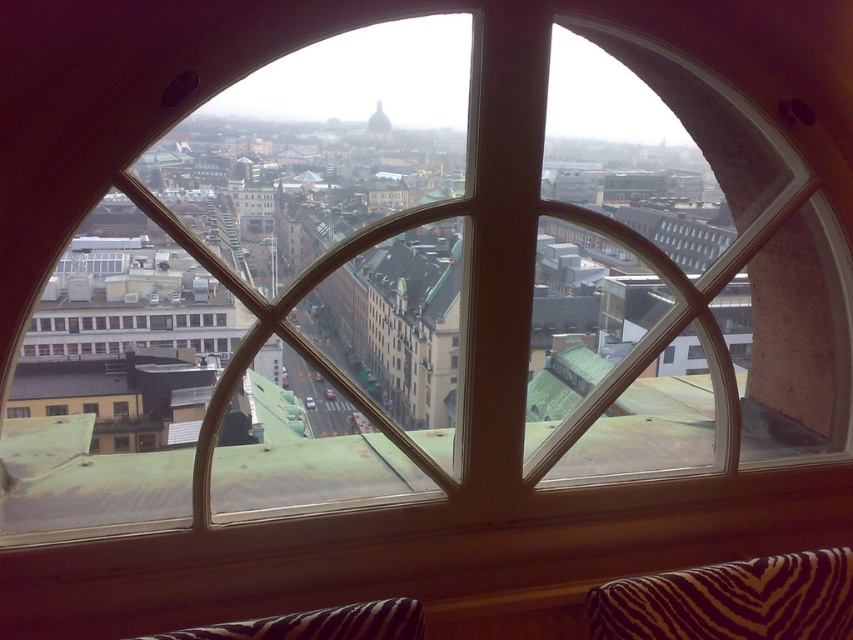
You are standing at the point labeled point [778,616] in a city with a grid of streets. The distance between them is 31.29 meters. If you need to walk to the other point, how many city blocks would that be assuming each block is 100 meters?

The distance between the two points is 31.29 meters. Since each city block is 100 meters, this distance is less than one full block. Therefore, you would only need to walk a fraction of a block, approximately 0.31 blocks.

You are standing in a room with a large arched window that has a diamond grid pattern. You notice two points marked on the window glass at coordinates point (209, 628) and point (65, 404). From your vantage point inside the room, which of these two points appears closer to you?

Point (209, 628) is in front of point (65, 404), so it appears closer to you.

From the picture: You are sitting on a couch and want to look out the transparent glass window at center. However, there is a zebra print fabric pillow at lower right in the way. Can you move the pillow to see the window clearly?

The zebra print fabric pillow at lower right is closer to the viewer than the transparent glass window at center, so moving it would allow you to see the window without obstruction.